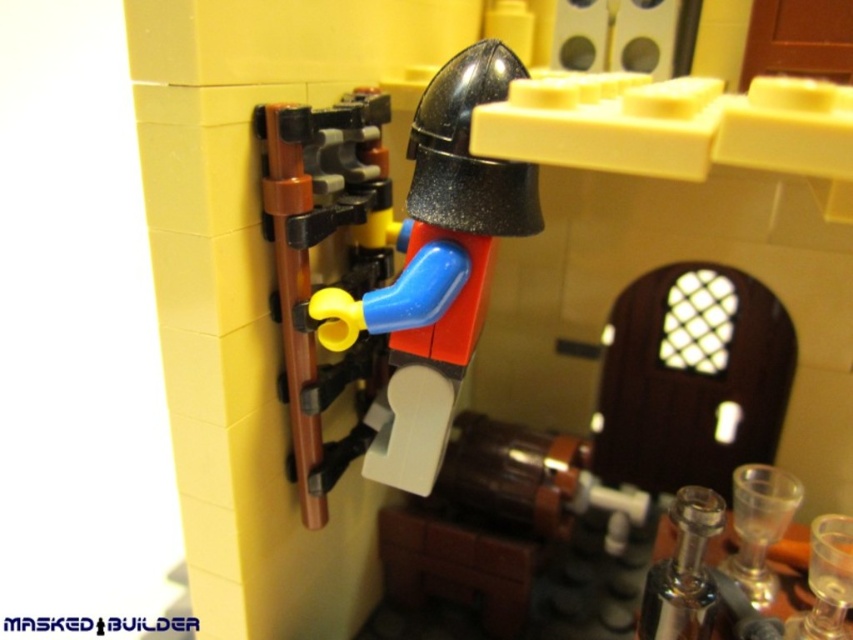
Is matte black helmet at center positioned at the back of yellow matte lever at center?

No, matte black helmet at center is in front of yellow matte lever at center.

Who is positioned more to the right, matte black helmet at center or yellow matte lever at center?

matte black helmet at center is more to the right.

Is point (405, 484) more distant than point (288, 228)?

Yes, point (405, 484) is behind point (288, 228).

In order to click on matte black helmet at center in this screenshot , I will do `click(437, 266)`.